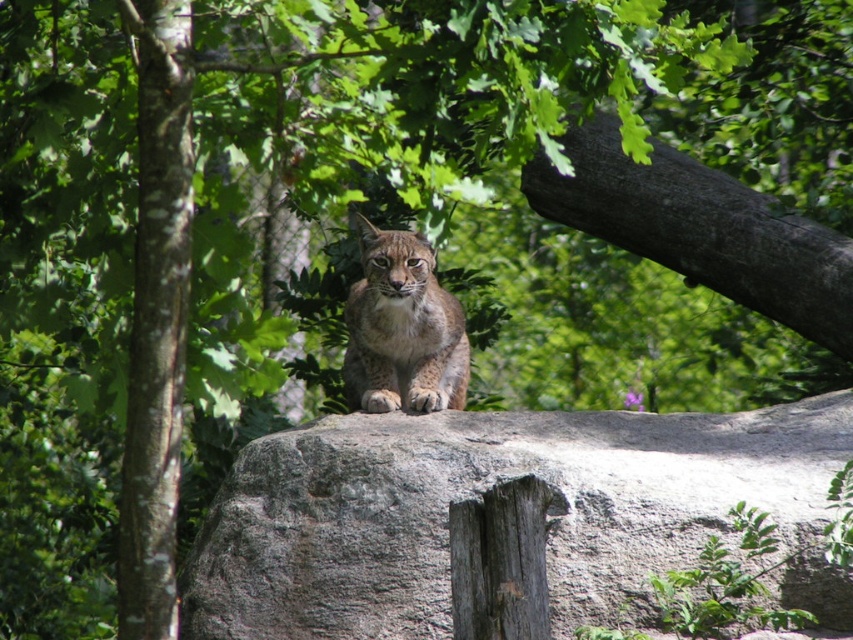
Is gray rough boulder at center smaller than dark brown rough tree trunk at upper right?

Actually, gray rough boulder at center might be larger than dark brown rough tree trunk at upper right.

This screenshot has height=640, width=853. In order to click on gray rough boulder at center in this screenshot , I will do [477, 496].

Looking at this image, does dark brown rough tree trunk at upper right have a lesser width compared to spotted fur cat at center?

In fact, dark brown rough tree trunk at upper right might be wider than spotted fur cat at center.

Is point (531, 189) less distant than point (433, 300)?

No.

Between point (780, 252) and point (357, 342), which one is positioned behind?

Point (780, 252)

In order to click on dark brown rough tree trunk at upper right in this screenshot , I will do `click(700, 228)`.

Is the position of white speckled bark at left less distant than that of spotted fur cat at center?

That is True.

Measure the distance from white speckled bark at left to spotted fur cat at center.

The distance of white speckled bark at left from spotted fur cat at center is 1.80 meters.

What do you see at coordinates (155, 317) in the screenshot? I see `white speckled bark at left` at bounding box center [155, 317].

The width and height of the screenshot is (853, 640). In order to click on white speckled bark at left in this screenshot , I will do `click(155, 317)`.